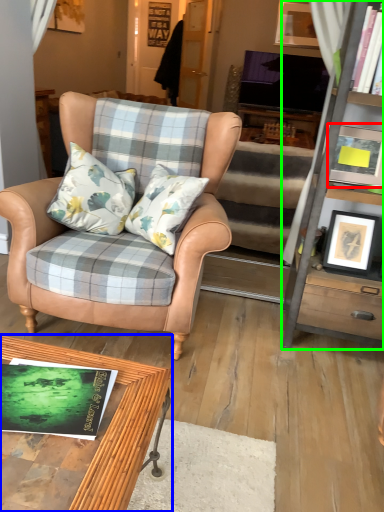
Question: Considering the real-world distances, which object is farthest from picture frame (highlighted by a red box)? coffee table (highlighted by a blue box) or cabinetry (highlighted by a green box)?

Choices:
 (A) coffee table
 (B) cabinetry

Answer: (A)